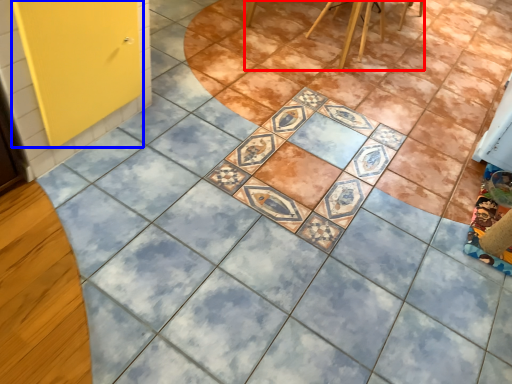
Question: Which object is closer to the camera taking this photo, furniture (highlighted by a red box) or screen door (highlighted by a blue box)?

Choices:
 (A) furniture
 (B) screen door

Answer: (B)